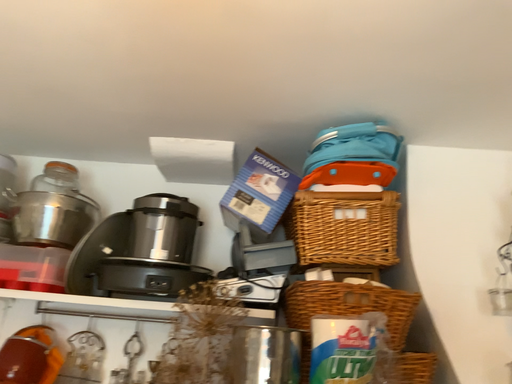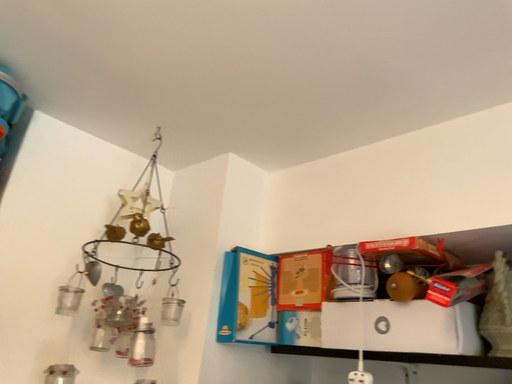
Question: Which way did the camera rotate in the video?

Choices:
 (A) rotated left
 (B) rotated right

Answer: (B)